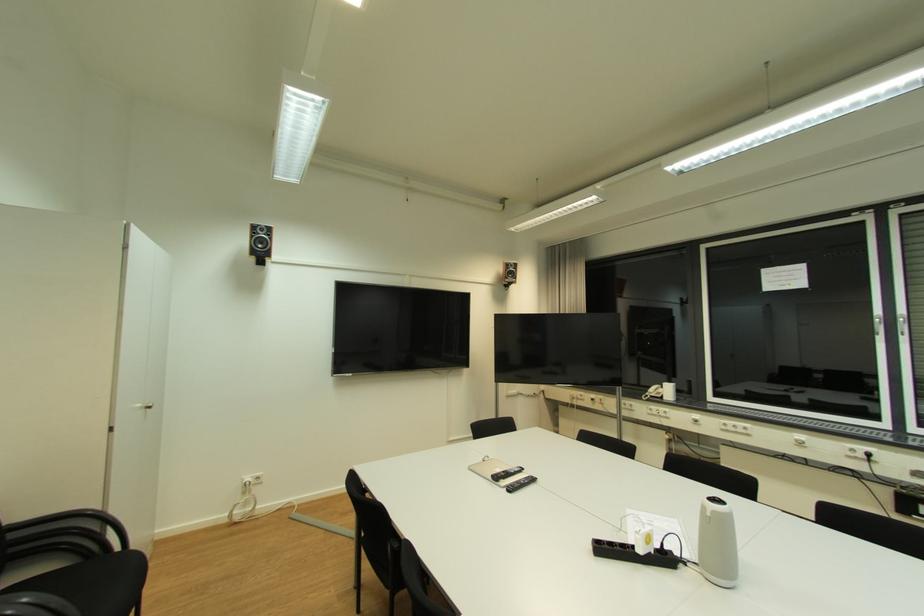
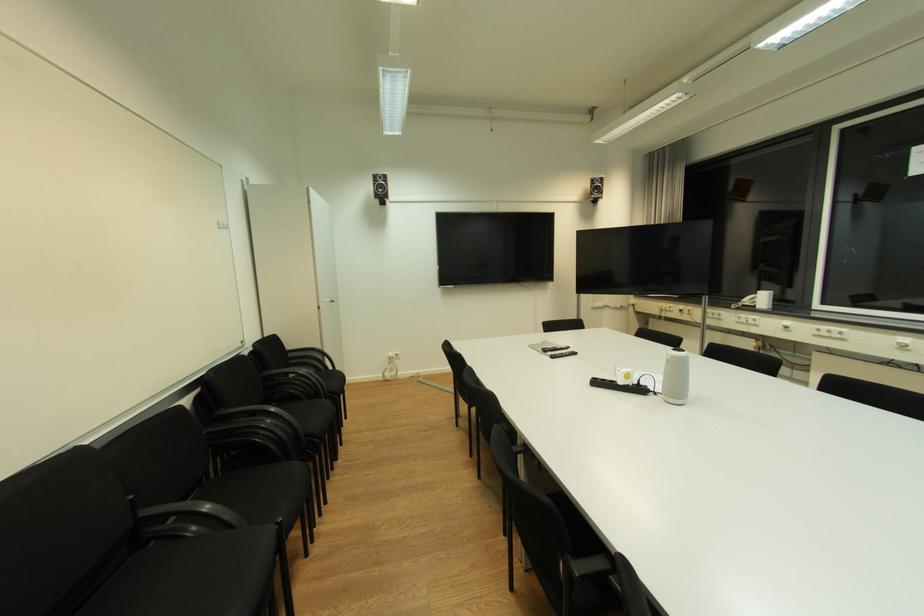
Where in the second image is the point corresponding to (720,513) from the first image?

(678, 358)